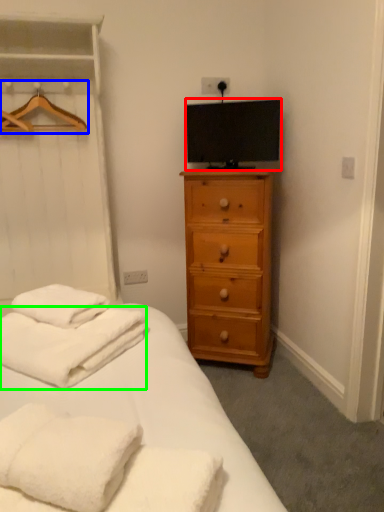
Question: Considering the real-world distances, which object is farthest from television (highlighted by a red box)? hanger (highlighted by a blue box) or bath towel (highlighted by a green box)?

Choices:
 (A) hanger
 (B) bath towel

Answer: (B)